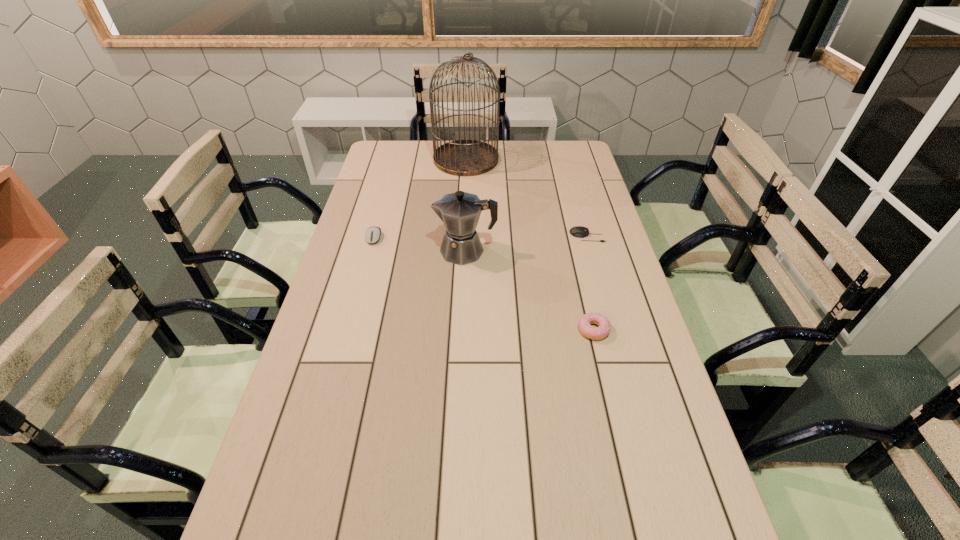
Locate an element on the screen. vacant region at the right edge is located at coordinates coord(564,210).

Find the location of `vacant region between the doughnut and the shorter mouse`. vacant region between the doughnut and the shorter mouse is located at coordinates (590, 283).

At what (x,y) coordinates should I click in order to perform the action: click on free space between the nearest object and the left mouse. Please return your answer as a coordinate pair (x, y). This screenshot has height=540, width=960. Looking at the image, I should click on (484, 284).

At what (x,y) coordinates should I click in order to perform the action: click on free spot between the farthest object and the shorter mouse. Please return your answer as a coordinate pair (x, y). This screenshot has height=540, width=960. Looking at the image, I should click on (526, 198).

You are a GUI agent. You are given a task and a screenshot of the screen. Output one action in this format:
    pyautogui.click(x=<x>, y=<y>)
    Task: Click on the empty location between the right mouse and the doughnut
    
    Given the screenshot: What is the action you would take?
    pyautogui.click(x=590, y=283)

This screenshot has height=540, width=960. Find the location of `free spot between the leftmost object and the coffeepot`. free spot between the leftmost object and the coffeepot is located at coordinates (420, 244).

Find the location of a particular element. This screenshot has height=540, width=960. vacant region between the farthest object and the shorter mouse is located at coordinates (526, 198).

The width and height of the screenshot is (960, 540). What are the coordinates of `blank region between the left mouse and the birdcage` in the screenshot? It's located at (420, 199).

This screenshot has width=960, height=540. I want to click on vacant area that lies between the birdcage and the shortest object, so click(526, 198).

Locate an element on the screen. This screenshot has width=960, height=540. unoccupied area between the left mouse and the farthest object is located at coordinates (420, 199).